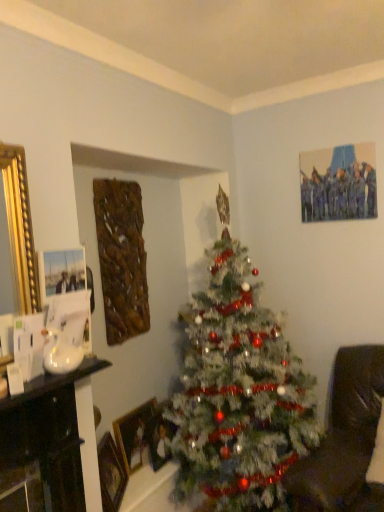
Describe the element at coordinates (344, 440) in the screenshot. I see `brown leather rocking chair at lower right` at that location.

Looking at this image, how much space does wooden picture frame at lower left, the second picture frame viewed from the back, occupy vertically?

The height of wooden picture frame at lower left, the second picture frame viewed from the back, is 14.61 inches.

What is the approximate width of white frosted christmas tree at center?

white frosted christmas tree at center is 32.84 inches in width.

Where is `brown leather rocking chair at lower right`? brown leather rocking chair at lower right is located at coordinates (344, 440).

From a real-world perspective, who is located higher, white glossy sink at left or white frosted christmas tree at center?

In real-world perspective, white frosted christmas tree at center is above.

Is white frosted christmas tree at center located within white glossy sink at left?

That's incorrect, white frosted christmas tree at center is not inside white glossy sink at left.

Is white glossy sink at left far away from white frosted christmas tree at center?

That's not correct — white glossy sink at left is a little close to white frosted christmas tree at center.

Locate an element on the screen. Image resolution: width=384 pixels, height=512 pixels. furniture that appears on the left of brown leather rocking chair at lower right is located at coordinates (48, 434).

Looking at this image, is the position of white glossy sink at left more distant than that of brown leather rocking chair at lower right?

Yes, it is behind brown leather rocking chair at lower right.

Is brown leather rocking chair at lower right at the back of white glossy sink at left?

No, brown leather rocking chair at lower right is not at the back of white glossy sink at left.

From the image's perspective, is white glossy sink at left located above brown leather rocking chair at lower right?

Yes, from the image's perspective, white glossy sink at left is on top of brown leather rocking chair at lower right.

Is the surface of wooden picture frame at lower left, the 3th picture frame viewed from the back, in direct contact with brown leather rocking chair at lower right?

No, wooden picture frame at lower left, the 3th picture frame viewed from the back, is not beside brown leather rocking chair at lower right.

Is wooden picture frame at lower left, which is the first picture frame from front to back, wider than brown leather rocking chair at lower right?

No.

Can you confirm if wooden picture frame at lower left, the 3th picture frame viewed from the back, is bigger than brown leather rocking chair at lower right?

Actually, wooden picture frame at lower left, the 3th picture frame viewed from the back, might be smaller than brown leather rocking chair at lower right.

Are wooden picture frame at lower left, the 3th picture frame viewed from the back, and wooden picture frame at lower left, the second picture frame viewed from the back, far apart?

No, wooden picture frame at lower left, the 3th picture frame viewed from the back, is not far away from wooden picture frame at lower left, the second picture frame viewed from the back.

Could you tell me if wooden picture frame at lower left, the 3th picture frame viewed from the back, is facing wooden picture frame at lower left, the second picture frame viewed from the back?

No, wooden picture frame at lower left, the 3th picture frame viewed from the back, is not oriented towards wooden picture frame at lower left, the second picture frame viewed from the back.

Is wooden picture frame at lower left, which is the first picture frame from front to back, at the left side of wooden picture frame at lower left, the second picture frame viewed from the back?

Yes.

Does wooden picture frame at lower left, the 3th picture frame viewed from the back, lie in front of wooden picture frame at lower left, marked as the 2th picture frame in a front-to-back arrangement?

Yes, it is in front of wooden picture frame at lower left, marked as the 2th picture frame in a front-to-back arrangement.

From a real-world perspective, is wooden picture frame at center, the 3th picture frame positioned from the front, on top of white frosted christmas tree at center?

Incorrect, from a real-world perspective, wooden picture frame at center, the 3th picture frame positioned from the front, is lower than white frosted christmas tree at center.

Is wooden picture frame at center, which appears as the first picture frame when viewed from the back, beside white frosted christmas tree at center?

No, wooden picture frame at center, which appears as the first picture frame when viewed from the back, is not making contact with white frosted christmas tree at center.

Which object is closer to the camera, wooden picture frame at center, which appears as the first picture frame when viewed from the back, or white frosted christmas tree at center?

white frosted christmas tree at center is closer to the camera.

Based on their positions, is wooden picture frame at center, the 3th picture frame positioned from the front, located to the left or right of white frosted christmas tree at center?

In the image, wooden picture frame at center, the 3th picture frame positioned from the front, appears on the left side of white frosted christmas tree at center.

Does brown leather rocking chair at lower right have a smaller size compared to white glossy sink at left?

Actually, brown leather rocking chair at lower right might be larger than white glossy sink at left.

Is brown leather rocking chair at lower right in front of or behind white glossy sink at left in the image?

Visually, brown leather rocking chair at lower right is located in front of white glossy sink at left.

From the image's perspective, is brown leather rocking chair at lower right above or below white glossy sink at left?

Based on their image positions, brown leather rocking chair at lower right is located beneath white glossy sink at left.

Considering the sizes of objects wooden picture frame at lower left, which is the first picture frame from front to back, and wooden picture frame at center, the 3th picture frame positioned from the front, in the image provided, who is smaller, wooden picture frame at lower left, which is the first picture frame from front to back, or wooden picture frame at center, the 3th picture frame positioned from the front,?

With smaller size is wooden picture frame at center, the 3th picture frame positioned from the front.

Which is farther from the camera, (x=103, y=498) or (x=163, y=419)?

Point (x=163, y=419)

Is wooden picture frame at lower left, which is the first picture frame from front to back, in contact with wooden picture frame at center, the 3th picture frame positioned from the front?

wooden picture frame at lower left, which is the first picture frame from front to back, is not next to wooden picture frame at center, the 3th picture frame positioned from the front, and they're not touching.

Is wooden picture frame at lower left, the 3th picture frame viewed from the back, facing towards wooden picture frame at center, which appears as the first picture frame when viewed from the back?

No, wooden picture frame at lower left, the 3th picture frame viewed from the back, is not oriented towards wooden picture frame at center, which appears as the first picture frame when viewed from the back.

Where is `christmas tree to the right of white glossy sink at left`? This screenshot has width=384, height=512. christmas tree to the right of white glossy sink at left is located at coordinates (238, 391).

At what (x,y) coordinates should I click in order to perform the action: click on furniture lying above the brown leather rocking chair at lower right (from the image's perspective). Please return your answer as a coordinate pair (x, y). The width and height of the screenshot is (384, 512). Looking at the image, I should click on (48, 434).

Considering their positions, is brown leather rocking chair at lower right positioned further to white frosted christmas tree at center than wooden picture frame at center, the 3th picture frame positioned from the front?

Among the two, wooden picture frame at center, the 3th picture frame positioned from the front, is located further to white frosted christmas tree at center.

Considering their positions, is wooden picture frame at lower left, the second picture frame viewed from the back, positioned further to white frosted christmas tree at center than wooden picture frame at lower left, which is the first picture frame from front to back?

wooden picture frame at lower left, which is the first picture frame from front to back, is further to white frosted christmas tree at center.

Based on their spatial positions, is wooden picture frame at lower left, the second picture frame viewed from the back, or brown leather rocking chair at lower right further from wooden picture frame at center, which appears as the first picture frame when viewed from the back?

brown leather rocking chair at lower right is positioned further to the anchor wooden picture frame at center, which appears as the first picture frame when viewed from the back.

From the image, which object appears to be farther from white glossy sink at left, wooden picture frame at center, the 3th picture frame positioned from the front, or white frosted christmas tree at center?

wooden picture frame at center, the 3th picture frame positioned from the front, is positioned further to the anchor white glossy sink at left.

From the picture: Based on their spatial positions, is brown leather rocking chair at lower right or wooden picture frame at lower left, the second picture frame viewed from the back, further from white glossy sink at left?

The object further to white glossy sink at left is brown leather rocking chair at lower right.

When comparing their distances from white frosted christmas tree at center, does white glossy sink at left or wooden picture frame at lower left, the second picture frame viewed from the back, seem closer?

wooden picture frame at lower left, the second picture frame viewed from the back, lies closer to white frosted christmas tree at center than the other object.

Considering their positions, is wooden picture frame at lower left, the second picture frame viewed from the back, positioned closer to wooden picture frame at lower left, the 3th picture frame viewed from the back, than brown leather rocking chair at lower right?

Based on the image, wooden picture frame at lower left, the second picture frame viewed from the back, appears to be nearer to wooden picture frame at lower left, the 3th picture frame viewed from the back.

Looking at the image, which one is located closer to wooden picture frame at lower left, the 3th picture frame viewed from the back, white glossy sink at left or white frosted christmas tree at center?

white glossy sink at left lies closer to wooden picture frame at lower left, the 3th picture frame viewed from the back, than the other object.

I want to click on picture frame located between white glossy sink at left and wooden picture frame at lower left, the second picture frame viewed from the back, in the depth direction, so click(x=111, y=473).

Locate an element on the screen. The image size is (384, 512). picture frame between wooden picture frame at lower left, which is the first picture frame from front to back, and wooden picture frame at center, the 3th picture frame positioned from the front, along the z-axis is located at coordinates (133, 434).

Where is `picture frame situated between wooden picture frame at lower left, marked as the 2th picture frame in a front-to-back arrangement, and brown leather rocking chair at lower right from left to right`? The width and height of the screenshot is (384, 512). picture frame situated between wooden picture frame at lower left, marked as the 2th picture frame in a front-to-back arrangement, and brown leather rocking chair at lower right from left to right is located at coordinates (159, 437).

Where is `christmas tree between wooden picture frame at center, which appears as the first picture frame when viewed from the back, and brown leather rocking chair at lower right from left to right`? Image resolution: width=384 pixels, height=512 pixels. christmas tree between wooden picture frame at center, which appears as the first picture frame when viewed from the back, and brown leather rocking chair at lower right from left to right is located at coordinates (238, 391).